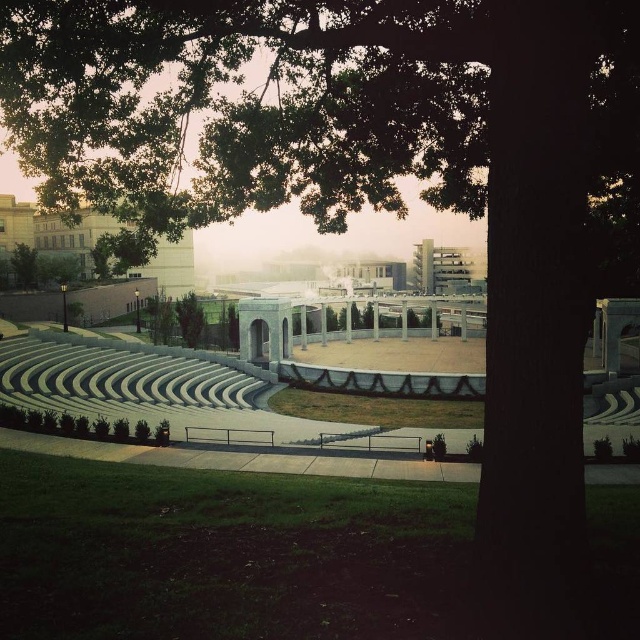
Question: Can you confirm if white marble amphitheater at upper left is positioned to the left of green leafy tree at left?

Choices:
 (A) yes
 (B) no

Answer: (B)

Question: Can you confirm if white marble amphitheater at upper left is positioned below green leafy tree at left?

Choices:
 (A) yes
 (B) no

Answer: (B)

Question: Does white marble amphitheater at upper left have a lesser width compared to green leafy tree at left?

Choices:
 (A) yes
 (B) no

Answer: (B)